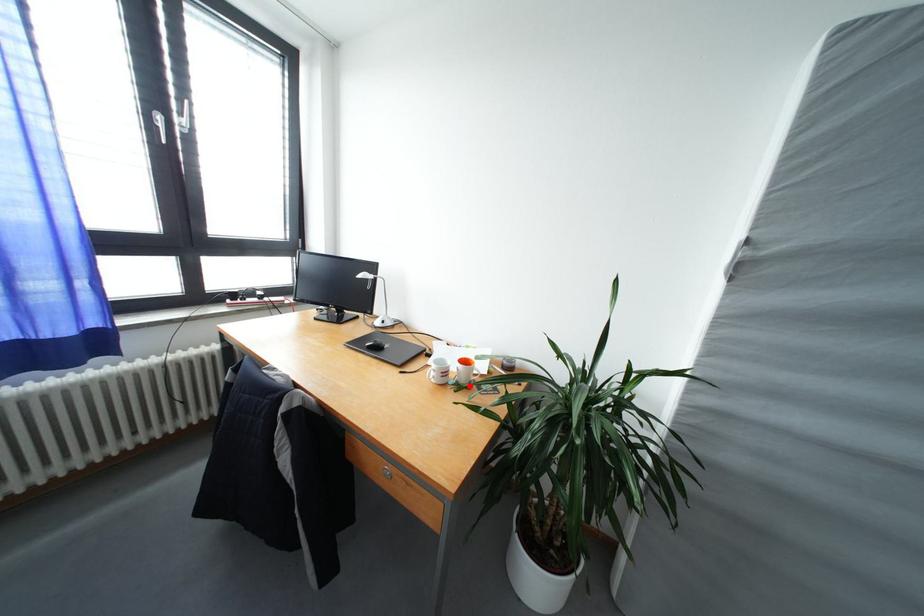
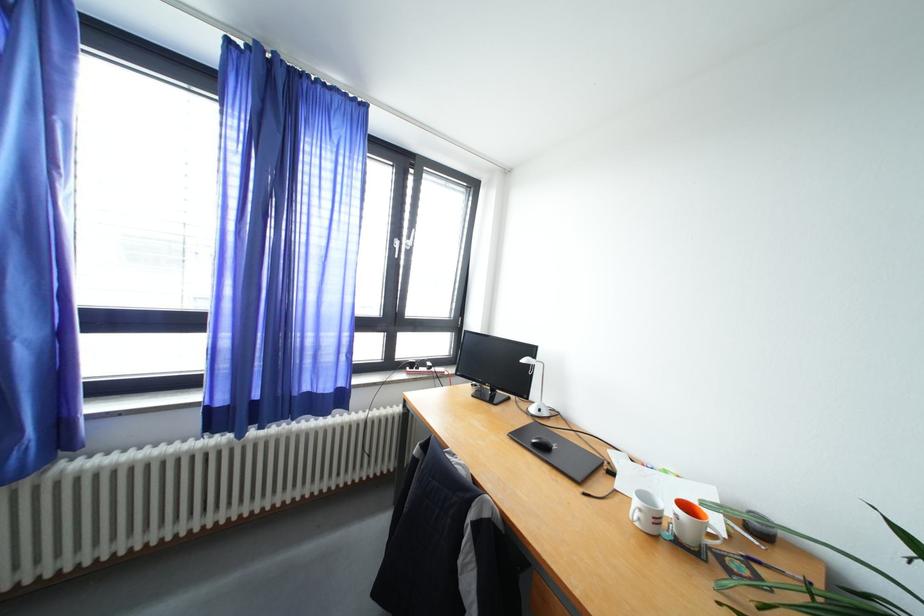
Question: I am providing you with two images of the same scene from different viewpoints. Given a red point in image1, look at the same physical point in image2. Is it:

Choices:
 (A) Closer to the viewpoint
 (B) Farther from the viewpoint

Answer: (A)